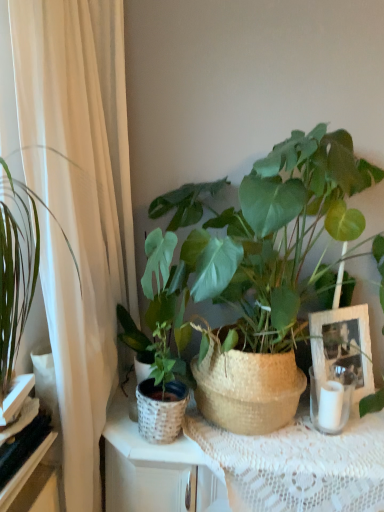
Question: From the image's perspective, does white sheer curtain at left appear higher than black glossy shelf at lower left, which is the 1th shelf from bottom to top?

Choices:
 (A) no
 (B) yes

Answer: (B)

Question: Considering the relative sizes of white sheer curtain at left and black glossy shelf at lower left, arranged as the 2th shelf when viewed from the top, in the image provided, is white sheer curtain at left shorter than black glossy shelf at lower left, arranged as the 2th shelf when viewed from the top,?

Choices:
 (A) yes
 (B) no

Answer: (B)

Question: From a real-world perspective, is white sheer curtain at left on top of black glossy shelf at lower left, arranged as the 2th shelf when viewed from the top?

Choices:
 (A) no
 (B) yes

Answer: (B)

Question: From the image's perspective, is white sheer curtain at left below black glossy shelf at lower left, arranged as the 2th shelf when viewed from the top?

Choices:
 (A) no
 (B) yes

Answer: (A)

Question: Does white sheer curtain at left have a larger size compared to black glossy shelf at lower left, arranged as the 2th shelf when viewed from the top?

Choices:
 (A) no
 (B) yes

Answer: (B)

Question: Is green woven basket at center, acting as the first houseplant starting from the right, to the left or to the right of white sheer curtain at left in the image?

Choices:
 (A) right
 (B) left

Answer: (A)

Question: Considering the positions of point click(x=304, y=232) and point click(x=57, y=379), is point click(x=304, y=232) closer or farther from the camera than point click(x=57, y=379)?

Choices:
 (A) farther
 (B) closer

Answer: (A)

Question: Considering the positions of green woven basket at center, which is counted as the second houseplant, starting from the left, and white sheer curtain at left in the image, is green woven basket at center, which is counted as the second houseplant, starting from the left, bigger or smaller than white sheer curtain at left?

Choices:
 (A) big
 (B) small

Answer: (A)

Question: From a real-world perspective, is green woven basket at center, acting as the first houseplant starting from the right, positioned above or below white sheer curtain at left?

Choices:
 (A) above
 (B) below

Answer: (A)

Question: Is green woven basket at center, which is counted as the second houseplant, starting from the left, taller or shorter than black glossy shelf at lower left, which is the 1th shelf from bottom to top?

Choices:
 (A) short
 (B) tall

Answer: (B)

Question: Is green woven basket at center, which is counted as the second houseplant, starting from the left, inside or outside of black glossy shelf at lower left, which is the 1th shelf from bottom to top?

Choices:
 (A) outside
 (B) inside

Answer: (A)

Question: In the image, is green woven basket at center, acting as the first houseplant starting from the right, positioned in front of or behind black glossy shelf at lower left, arranged as the 2th shelf when viewed from the top?

Choices:
 (A) behind
 (B) front

Answer: (A)

Question: From the image's perspective, is green woven basket at center, acting as the first houseplant starting from the right, located above or below black glossy shelf at lower left, which is the 1th shelf from bottom to top?

Choices:
 (A) above
 (B) below

Answer: (A)

Question: Considering the positions of white wicker picture frame at center right and white sheer curtain at left in the image, is white wicker picture frame at center right taller or shorter than white sheer curtain at left?

Choices:
 (A) tall
 (B) short

Answer: (B)

Question: Is white wicker picture frame at center right wider or thinner than white sheer curtain at left?

Choices:
 (A) wide
 (B) thin

Answer: (B)